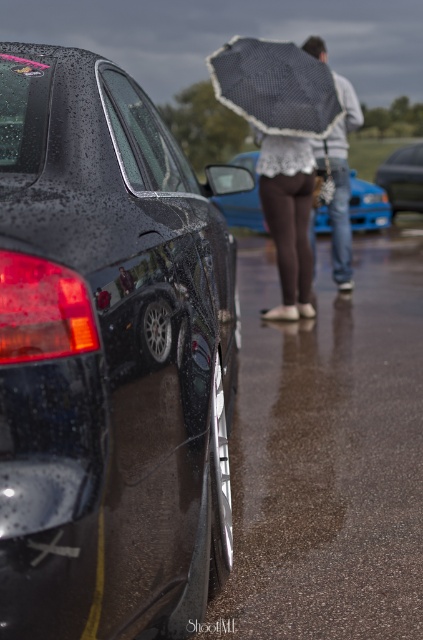
In the scene shown: Can you confirm if white lace umbrella at center is positioned to the left of brown fabric skirt at center?

Incorrect, white lace umbrella at center is not on the left side of brown fabric skirt at center.

Who is higher up, white lace umbrella at center or brown fabric skirt at center?

white lace umbrella at center is higher up.

This screenshot has height=640, width=423. What are the coordinates of `white lace umbrella at center` in the screenshot? It's located at (288, 218).

Can you confirm if white lace umbrella at center is shorter than metallic blue sedan at center?

No, white lace umbrella at center is not shorter than metallic blue sedan at center.

How far apart are white lace umbrella at center and metallic blue sedan at center?

A distance of 6.88 meters exists between white lace umbrella at center and metallic blue sedan at center.

Where is `white lace umbrella at center`? white lace umbrella at center is located at coordinates (288, 218).

How distant is shiny black car at left from white lace umbrella at upper center?

A distance of 5.47 meters exists between shiny black car at left and white lace umbrella at upper center.

Is shiny black car at left positioned at the back of white lace umbrella at upper center?

No, it is not.

Is point (62, 157) closer to camera compared to point (332, 152)?

Yes, point (62, 157) is closer to viewer.

I want to click on shiny black car at left, so pyautogui.click(x=109, y=356).